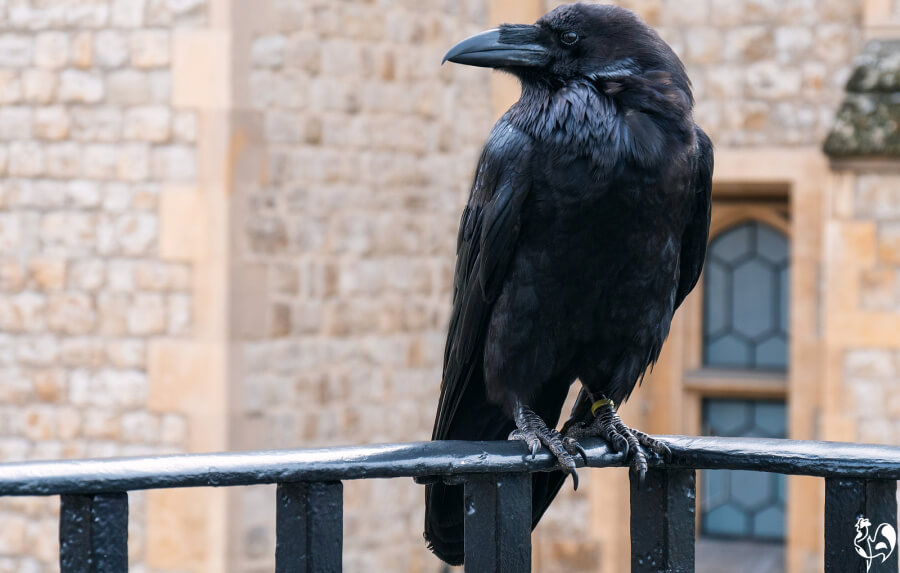
The height and width of the screenshot is (573, 900). I want to click on window sill, so click(735, 553).